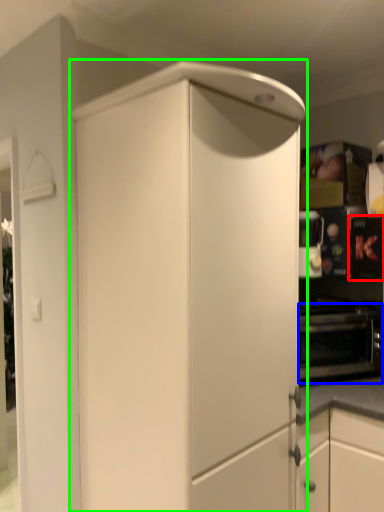
Question: Considering the real-world distances, which object is farthest from appliance (highlighted by a red box)? oven (highlighted by a blue box) or cabinetry (highlighted by a green box)?

Choices:
 (A) oven
 (B) cabinetry

Answer: (B)